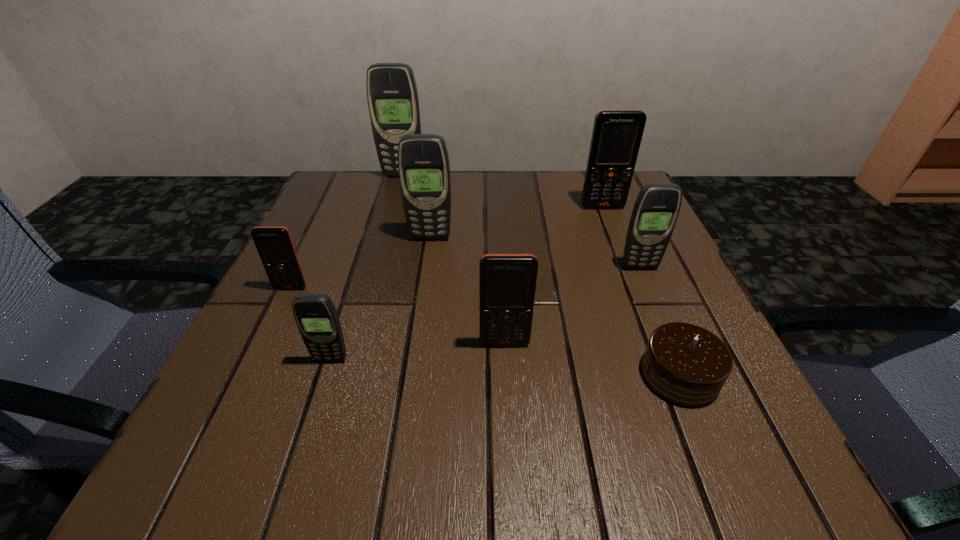
You are a GUI agent. You are given a task and a screenshot of the screen. Output one action in this format:
    pyautogui.click(x=<x>, y=<y>)
    Task: Click on the orange cellular telephone that stands as the second closest to the rightmost gray cellular telephone
    This screenshot has width=960, height=540.
    Given the screenshot: What is the action you would take?
    pyautogui.click(x=507, y=282)

Locate an element on the screen. This screenshot has height=540, width=960. blank space that satisfies the following two spatial constraints: 1. on the screen of the smallest gray cellular telephone; 2. on the left side of the chocolate cake is located at coordinates (326, 374).

Identify the location of vacant area that satisfies the following two spatial constraints: 1. on the screen of the shortest object; 2. on the right side of the fourth object from right to left. (506, 374).